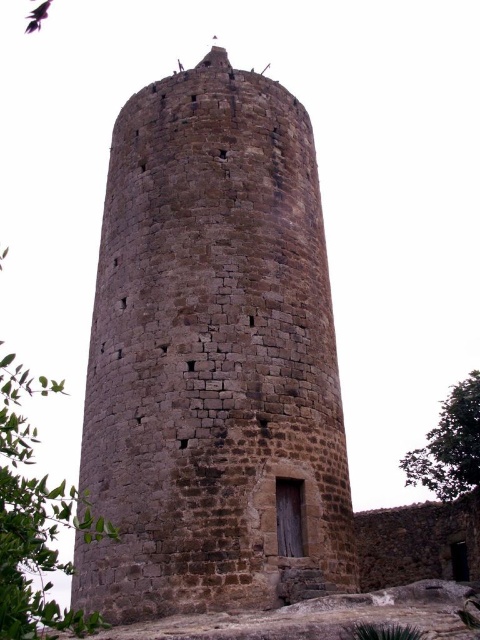
Question: Considering the real-world distances, which object is closest to the green leafy tree at right?

Choices:
 (A) green leafy tree at left
 (B) brown stone tower at center

Answer: (B)

Question: Is brown stone tower at center positioned behind green leafy tree at right?

Choices:
 (A) no
 (B) yes

Answer: (A)

Question: Does green leafy tree at left have a smaller size compared to green leafy tree at right?

Choices:
 (A) yes
 (B) no

Answer: (B)

Question: Which is farther from the green leafy tree at left?

Choices:
 (A) green leafy tree at right
 (B) brown stone tower at center

Answer: (A)

Question: Which point appears farthest from the camera in this image?

Choices:
 (A) (478, 385)
 (B) (248, 454)

Answer: (A)

Question: From the image, what is the correct spatial relationship of green leafy tree at left in relation to green leafy tree at right?

Choices:
 (A) left
 (B) right

Answer: (A)